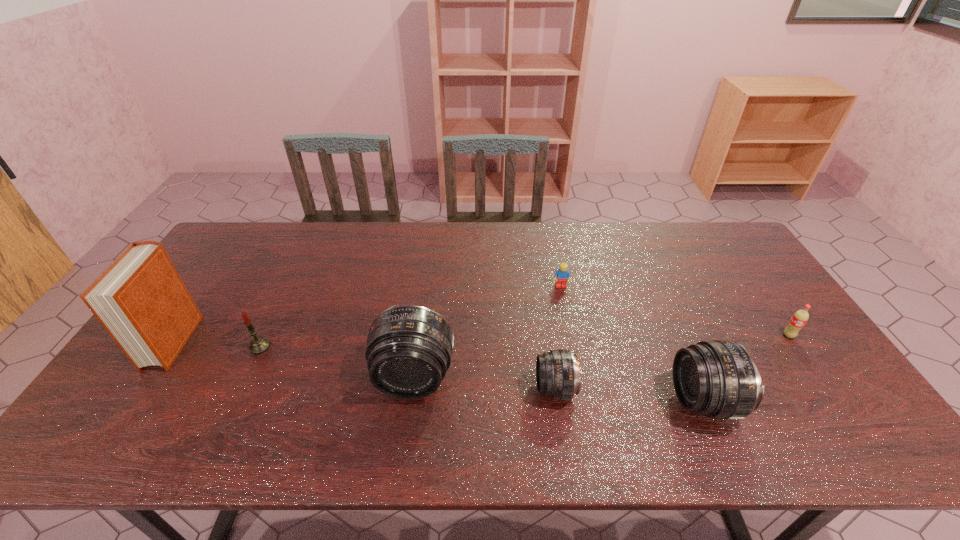
In order to click on object that is at the left edge in this screenshot , I will do `click(140, 299)`.

The width and height of the screenshot is (960, 540). I want to click on object present at the right edge, so click(800, 317).

What are the coordinates of `vacant space at the far edge of the desktop` in the screenshot? It's located at (605, 260).

Find the location of a particular element. This screenshot has width=960, height=540. free point at the near edge is located at coordinates (309, 401).

Find the location of a particular element. This screenshot has width=960, height=540. vacant space at the right edge of the desktop is located at coordinates (732, 285).

In the image, there is a desktop. Where is `vacant space at the near left corner`? This screenshot has height=540, width=960. vacant space at the near left corner is located at coordinates click(x=171, y=389).

Find the location of a particular element. This screenshot has height=540, width=960. free space between the Lego and the leftmost object is located at coordinates (368, 314).

I want to click on vacant area that lies between the second object from left to right and the leftmost telephoto lens, so click(337, 362).

Locate an element on the screen. free space that is in between the hardback book and the fifth object from right to left is located at coordinates (294, 359).

This screenshot has width=960, height=540. I want to click on vacant area between the sixth object from left to right and the second telephoto lens from right to left, so coord(629,395).